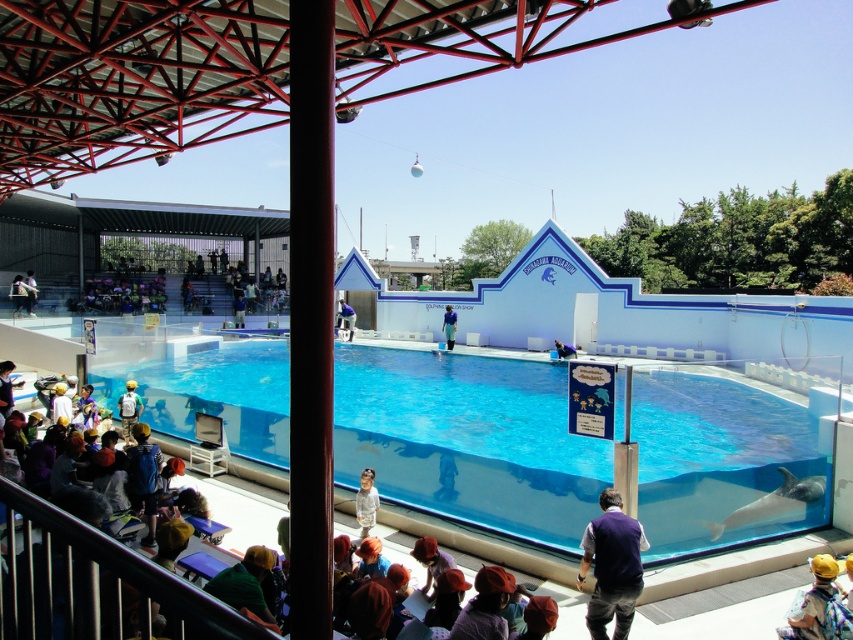
You are standing at the dolphin show at the Suma Aquarium and want to take a photo of the dolphin in the pool. The dolphin is located at point (x=641, y=566). If your camera has a maximum focus range of 5 meters, will you be able to focus on the dolphin?

The point (x=641, y=566) is 5.52 meters from the viewer, which exceeds the camera maximum focus range of 5 meters. So you cannot focus on the dolphin.

You are a visitor at the Suma Aquarium and want to lean against the metallic gray rail at lower left while watching the dolphin show. However, you are wearing a dark blue vest at lower center. Will the rail be tall enough to lean on comfortably?

The metallic gray rail at lower left has a lesser height compared to dark blue vest at lower center. Since the rail is shorter than your vest, it might not be tall enough to lean against comfortably.

You are a visitor at the Suma Aquarium and want to move from the dark blue vest at lower center to the matte purple seats at upper left. Given that you can walk at a speed of 1.5 meters per second, how long will it take you to reach the seats?

The distance between the dark blue vest at lower center and the matte purple seats at upper left is 33.58 meters. At a walking speed of 1.5 meters per second, it would take approximately 22.39 seconds to reach the seats.